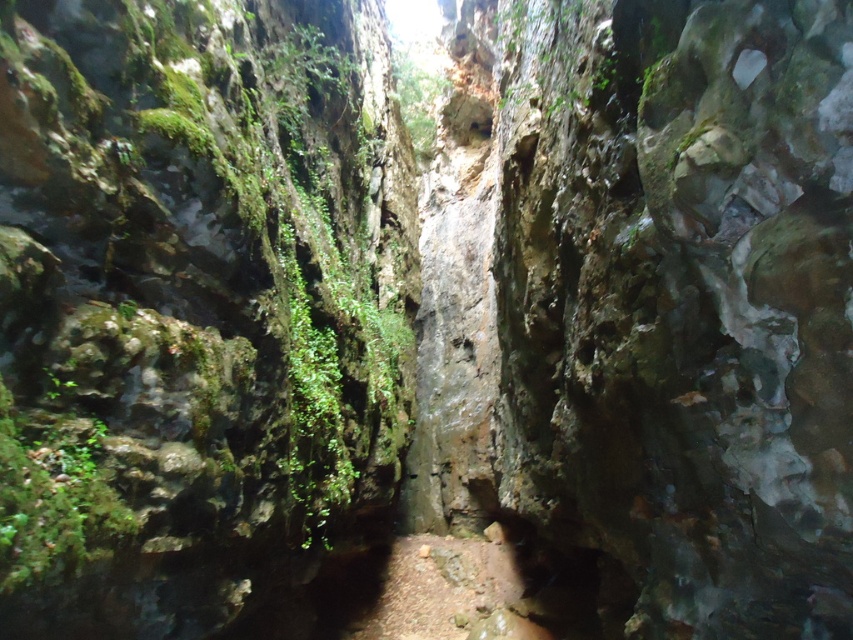
Looking at this image, which is more to the left, green mossy rock at left or dirt/granular path at center?

green mossy rock at left

Who is taller, green mossy rock at left or dirt/granular path at center?

With more height is green mossy rock at left.

Does point (77, 554) come in front of point (480, 552)?

Yes, point (77, 554) is in front of point (480, 552).

The height and width of the screenshot is (640, 853). I want to click on green mossy rock at left, so click(53, 497).